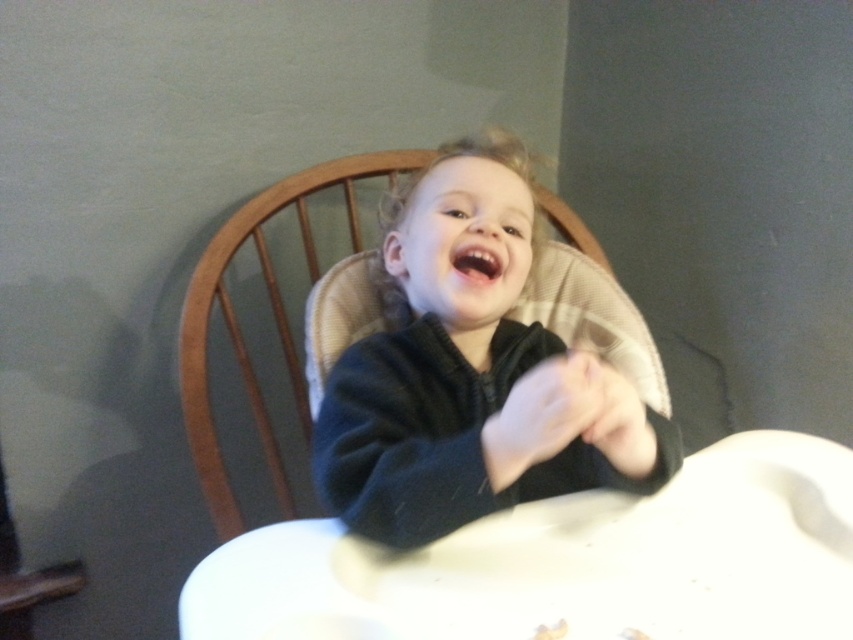
Question: Estimate the real-world distances between objects in this image. Which object is closer to the dark blue fleece at center?

Choices:
 (A) matte black hand at center
 (B) white matte hand at center
 (C) white plastic high chair at center

Answer: (C)

Question: Can you confirm if dark blue fleece at center is thinner than matte black hand at center?

Choices:
 (A) no
 (B) yes

Answer: (A)

Question: Is dark blue fleece at center wider than matte black hand at center?

Choices:
 (A) yes
 (B) no

Answer: (A)

Question: Is white matte hand at center wider than matte black hand at center?

Choices:
 (A) yes
 (B) no

Answer: (B)

Question: Which point is closer to the camera taking this photo?

Choices:
 (A) (634, 524)
 (B) (641, 472)
 (C) (581, 433)
 (D) (514, 182)

Answer: (C)

Question: Which point is farther to the camera?

Choices:
 (A) (590, 385)
 (B) (363, 522)
 (C) (547, 428)

Answer: (B)